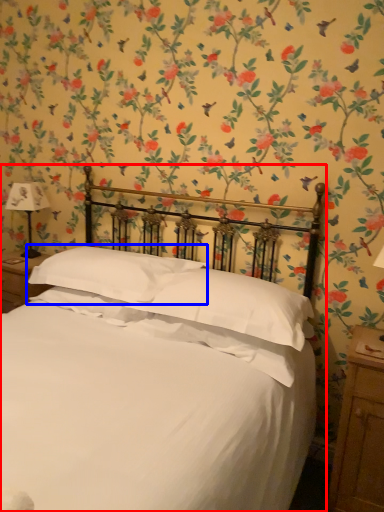
Question: Which point is closer to the camera, bed (highlighted by a red box) or pillow (highlighted by a blue box)?

Choices:
 (A) bed
 (B) pillow

Answer: (A)